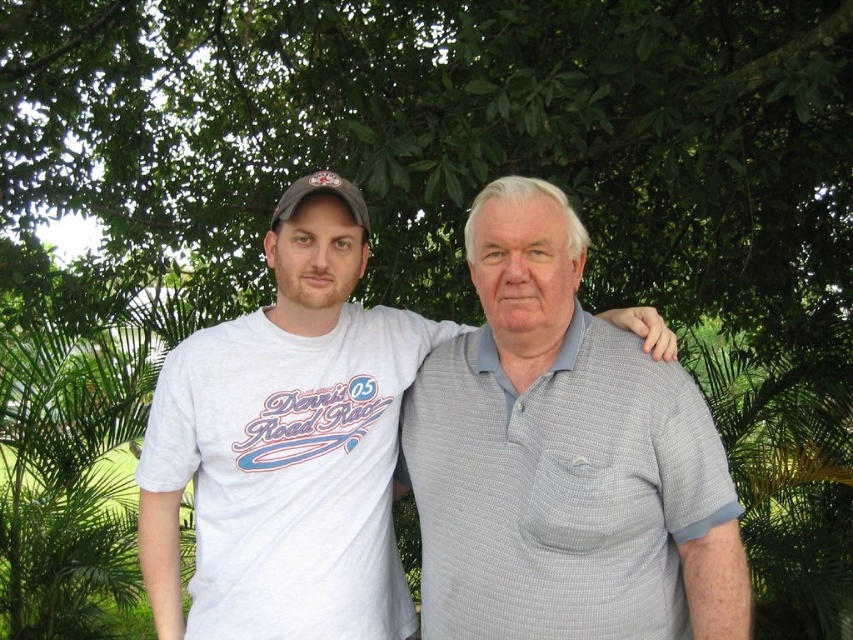
Question: Which of the following is the closest to the observer?

Choices:
 (A) (339, 426)
 (B) (315, 193)
 (C) (527, 340)

Answer: (C)

Question: Is white cotton t-shirt at left below matte gray baseball cap at left?

Choices:
 (A) no
 (B) yes

Answer: (B)

Question: Which point appears farthest from the camera in this image?

Choices:
 (A) (311, 310)
 (B) (531, 227)
 (C) (363, 211)

Answer: (C)

Question: Is gray textured polo shirt at center behind white cotton t-shirt at left?

Choices:
 (A) yes
 (B) no

Answer: (B)

Question: Can you confirm if gray textured polo shirt at center is thinner than white cotton t-shirt at left?

Choices:
 (A) yes
 (B) no

Answer: (A)

Question: Which point is farther to the camera?

Choices:
 (A) white cotton t-shirt at left
 (B) gray textured polo shirt at center

Answer: (A)